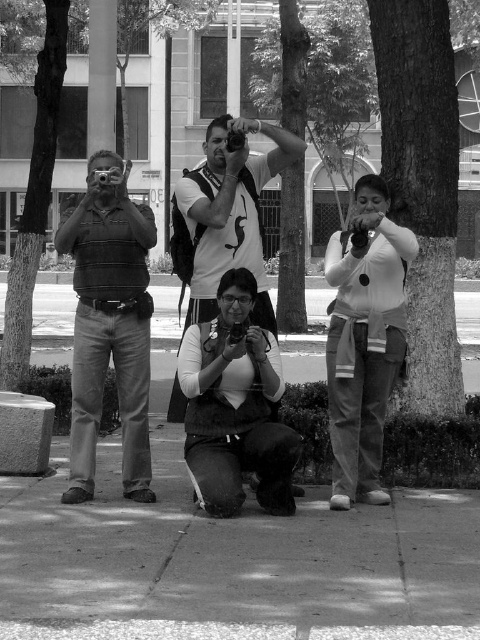
Based on the scene description, can you determine which object is taller between the rough bark tree at center and the matte white shirt at center?

The rough bark tree at center is much taller than the matte white shirt at center.

Based on the scene description, where is the matte white shirt at center located in terms of its 2D coordinates?

The matte white shirt at center is located at the 2D coordinates point (x=364, y=339).

You are standing in the scene and want to take a photo of the rough bark tree at center. If your camera has a maximum focusing distance of 6 meters, will you be able to focus on the tree?

The rough bark tree at center is 6.05 meters away from the viewer. Since the camera can only focus up to 6 meters, it cannot focus on the tree because it is slightly beyond the maximum distance.